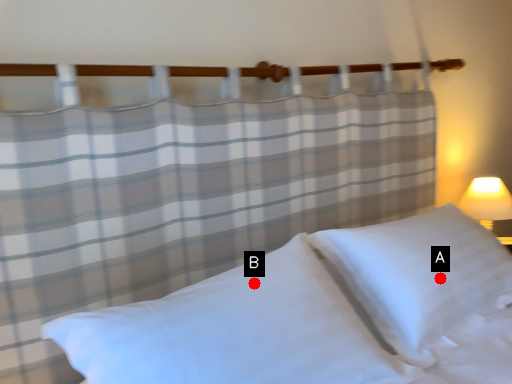
Question: Two points are circled on the image, labeled by A and B beside each circle. Which point appears closest to the camera in this image?

Choices:
 (A) A is closer
 (B) B is closer

Answer: (B)